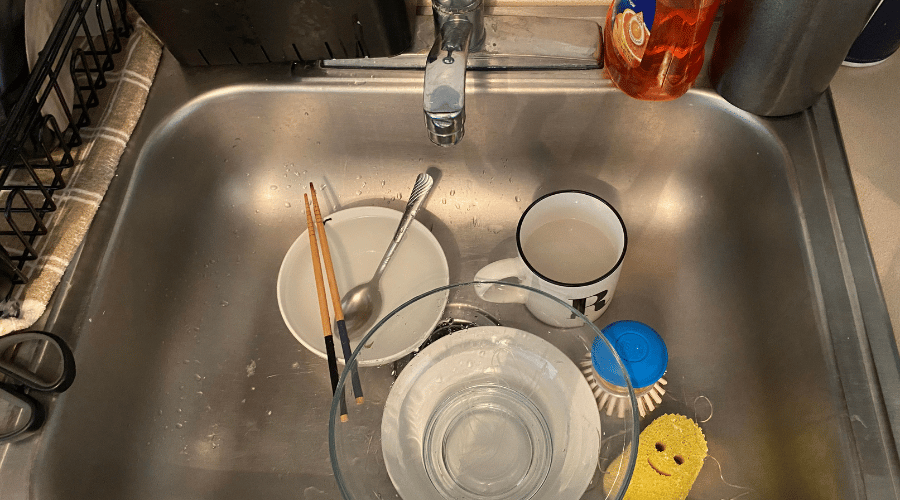
You are a GUI agent. You are given a task and a screenshot of the screen. Output one action in this format:
    pyautogui.click(x=<x>, y=<y>)
    Task: Click on the plate
    
    Given the screenshot: What is the action you would take?
    pyautogui.click(x=587, y=409)